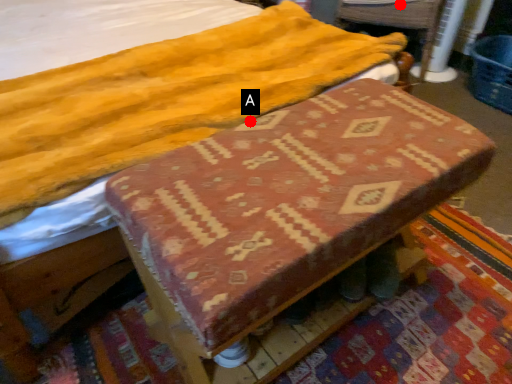
Question: Two points are circled on the image, labeled by A and B beside each circle. Among these points, which one is nearest to the camera?

Choices:
 (A) A is closer
 (B) B is closer

Answer: (A)